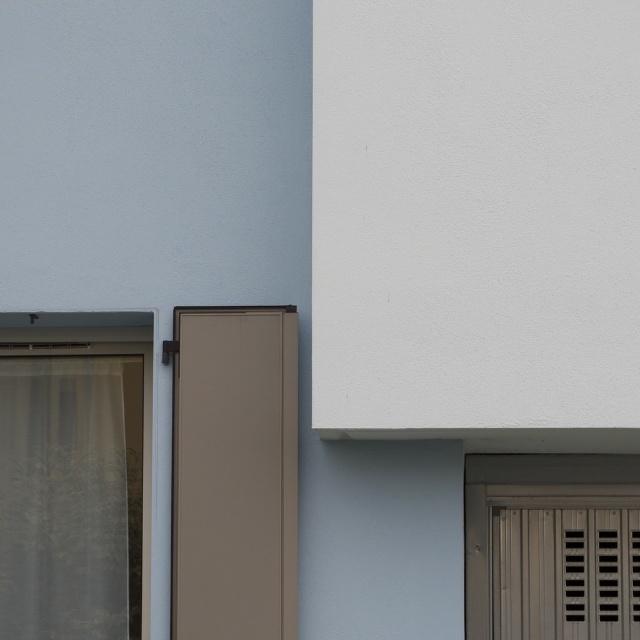
You are standing in front of a building with a light blue wall on the left and white wall on the right. There is a point marked at coordinates (234, 474). What object is located at that point?

The point at coordinates (234, 474) marks the location of the matte brown screen door at center.

You are standing in front of the building and want to enter through one of the doors. Which door is easier to reach without moving your position? The matte brown screen door at center or the matte gray slatted door at lower right?

The matte brown screen door at center is closer to the viewer than the matte gray slatted door at lower right, so it is easier to reach without moving your position.